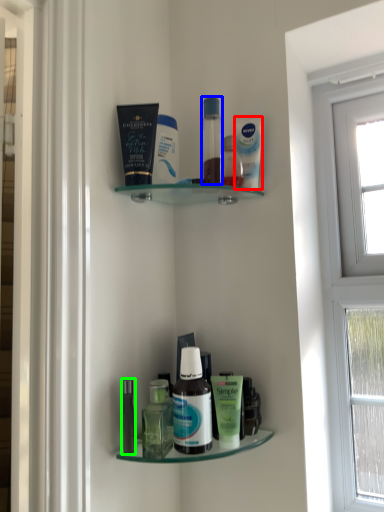
Question: Considering the real-world distances, which object is closest to mouthwash (highlighted by a red box)? toiletry (highlighted by a blue box) or toiletry (highlighted by a green box).

Choices:
 (A) toiletry
 (B) toiletry

Answer: (A)